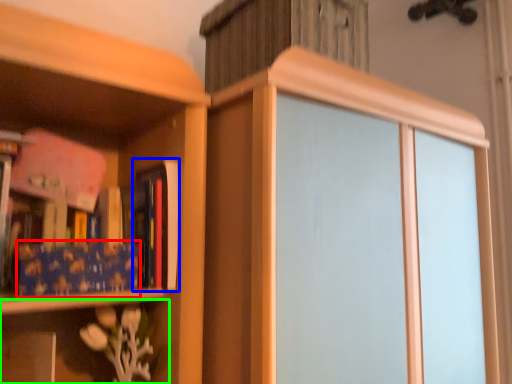
Question: Based on their relative distances, which object is nearer to paperback book (highlighted by a red box)? Choose from book (highlighted by a blue box) and shelf (highlighted by a green box).

Choices:
 (A) book
 (B) shelf

Answer: (A)